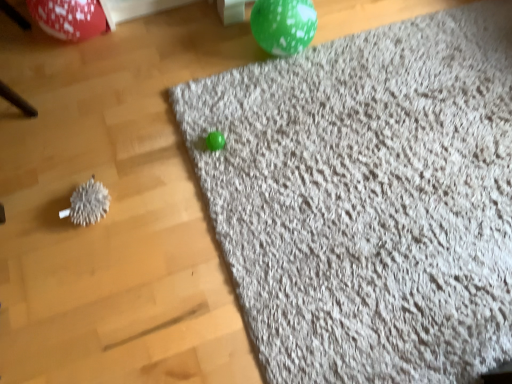
Question: Considering the relative sizes of white fuzzy ball at left and green speckled balloon at upper center, marked as the first balloon in a right-to-left arrangement, in the image provided, is white fuzzy ball at left smaller than green speckled balloon at upper center, marked as the first balloon in a right-to-left arrangement,?

Choices:
 (A) yes
 (B) no

Answer: (A)

Question: Considering the relative sizes of white fuzzy ball at left and green speckled balloon at upper center, marked as the first balloon in a right-to-left arrangement, in the image provided, is white fuzzy ball at left shorter than green speckled balloon at upper center, marked as the first balloon in a right-to-left arrangement,?

Choices:
 (A) no
 (B) yes

Answer: (B)

Question: From a real-world perspective, is white fuzzy ball at left over green speckled balloon at upper center, which appears as the second balloon when viewed from the left?

Choices:
 (A) yes
 (B) no

Answer: (B)

Question: Is green speckled balloon at upper center, which appears as the second balloon when viewed from the left, located within white fuzzy ball at left?

Choices:
 (A) yes
 (B) no

Answer: (B)

Question: From a real-world perspective, is white fuzzy ball at left physically below green speckled balloon at upper center, marked as the first balloon in a right-to-left arrangement?

Choices:
 (A) yes
 (B) no

Answer: (A)

Question: Is white fuzzy ball at left wider or thinner than shiny red balloon at upper left, which is counted as the first balloon, starting from the left?

Choices:
 (A) wide
 (B) thin

Answer: (B)

Question: Considering the relative positions of white fuzzy ball at left and shiny red balloon at upper left, which is counted as the first balloon, starting from the left, in the image provided, is white fuzzy ball at left to the left or to the right of shiny red balloon at upper left, which is counted as the first balloon, starting from the left,?

Choices:
 (A) right
 (B) left

Answer: (A)

Question: From the image's perspective, is white fuzzy ball at left located above or below shiny red balloon at upper left, which is counted as the first balloon, starting from the left?

Choices:
 (A) below
 (B) above

Answer: (A)

Question: Is white fuzzy ball at left bigger or smaller than shiny red balloon at upper left, which is counted as the first balloon, starting from the left?

Choices:
 (A) small
 (B) big

Answer: (A)

Question: Considering the positions of shiny red balloon at upper left, which is counted as the first balloon, starting from the left, and white fuzzy ball at left in the image, is shiny red balloon at upper left, which is counted as the first balloon, starting from the left, taller or shorter than white fuzzy ball at left?

Choices:
 (A) short
 (B) tall

Answer: (B)

Question: Based on their positions, is shiny red balloon at upper left, which is counted as the first balloon, starting from the left, located to the left or right of white fuzzy ball at left?

Choices:
 (A) right
 (B) left

Answer: (B)

Question: In the image, is shiny red balloon at upper left, which is counted as the first balloon, starting from the left, positioned in front of or behind white fuzzy ball at left?

Choices:
 (A) behind
 (B) front

Answer: (A)

Question: Is shiny red balloon at upper left, marked as the second balloon in a right-to-left arrangement, spatially inside white fuzzy ball at left, or outside of it?

Choices:
 (A) outside
 (B) inside

Answer: (A)

Question: Is point (74, 198) positioned closer to the camera than point (257, 39)?

Choices:
 (A) closer
 (B) farther

Answer: (A)

Question: Considering the relative positions of white fuzzy ball at left and green speckled balloon at upper center, which appears as the second balloon when viewed from the left, in the image provided, is white fuzzy ball at left to the left or to the right of green speckled balloon at upper center, which appears as the second balloon when viewed from the left,?

Choices:
 (A) left
 (B) right

Answer: (A)